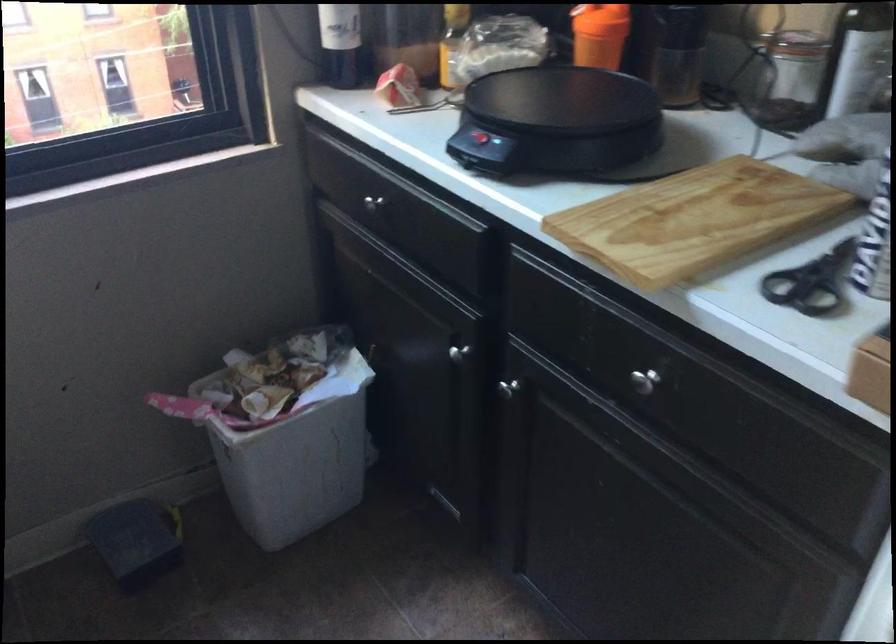
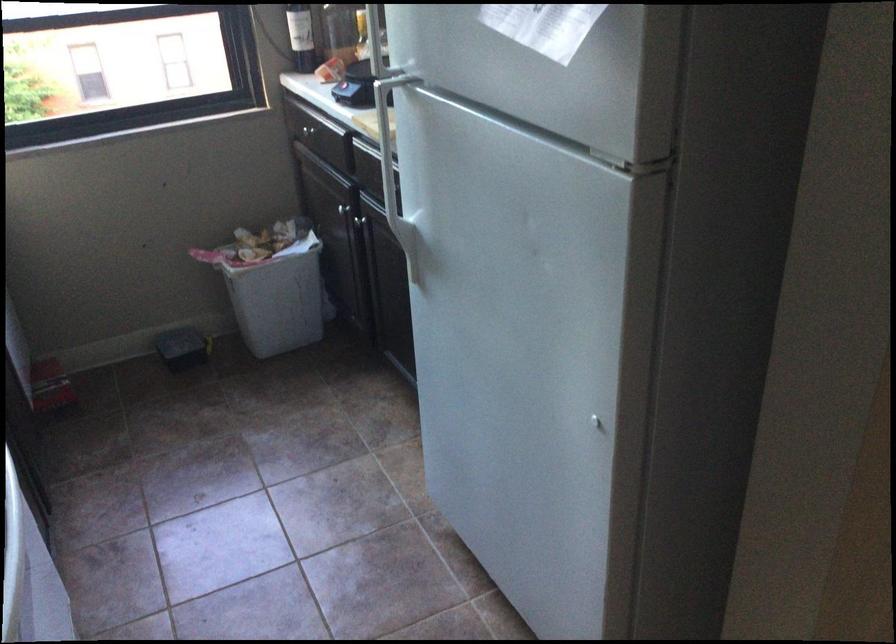
Question: I am providing you with two images of the same scene from different viewpoints. Please identify which objects are invisible in image2.

Choices:
 (A) dark cabinet handle
 (B) white trash can
 (C) silver plant pot
 (D) black scissors

Answer: (D)